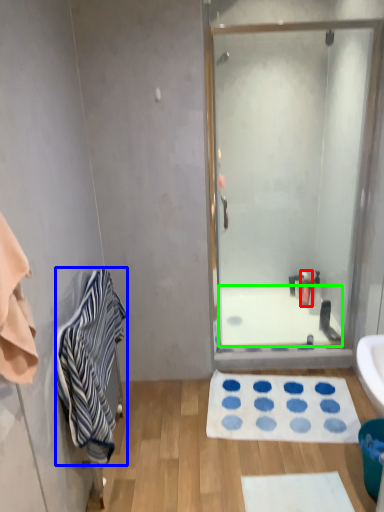
Question: Considering the real-world distances, which object is farthest from toiletry (highlighted by a red box)? towel/napkin (highlighted by a blue box) or bath (highlighted by a green box)?

Choices:
 (A) towel/napkin
 (B) bath

Answer: (A)